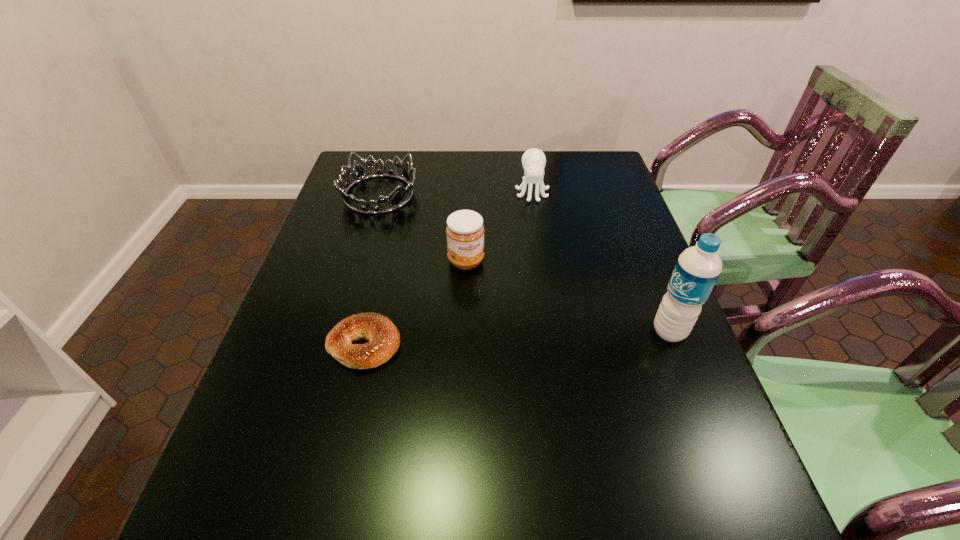
Find the location of a particular element. free space located on the label of the tallest object is located at coordinates (630, 332).

At what (x,y) coordinates should I click in order to perform the action: click on vacant space situated 0.140m on the front-facing side of the second object from right to left. Please return your answer as a coordinate pair (x, y). Looking at the image, I should click on (538, 231).

The image size is (960, 540). Identify the location of vacant position located 0.300m on the front-facing side of the second object from right to left. (542, 269).

This screenshot has height=540, width=960. In order to click on vacant space situated 0.250m on the front-facing side of the second object from right to left in this screenshot , I will do `click(540, 256)`.

Where is `vacant area situated on the front label of the third farthest object`? vacant area situated on the front label of the third farthest object is located at coordinates pos(507,342).

Identify the location of free location located 0.130m on the front label of the third farthest object. The image size is (960, 540). (490, 308).

Identify the location of blank space located on the front label of the third farthest object. Image resolution: width=960 pixels, height=540 pixels. (499, 326).

Where is `vacant space located on the front-facing side of the tiara`? vacant space located on the front-facing side of the tiara is located at coordinates (486, 277).

At what (x,y) coordinates should I click in order to perform the action: click on free spot located 0.120m on the front-facing side of the tiara. Please return your answer as a coordinate pair (x, y). The image size is (960, 540). Looking at the image, I should click on (x=424, y=229).

Locate an element on the screen. vacant region located on the front-facing side of the tiara is located at coordinates (486, 277).